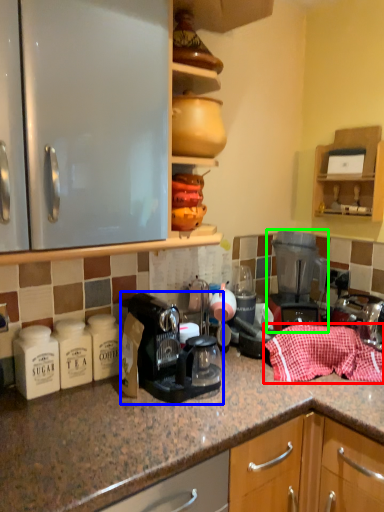
Question: Estimate the real-world distances between objects in this image. Which object is farther from material (highlighted by a red box), coffee machine (highlighted by a blue box) or home appliance (highlighted by a green box)?

Choices:
 (A) coffee machine
 (B) home appliance

Answer: (A)